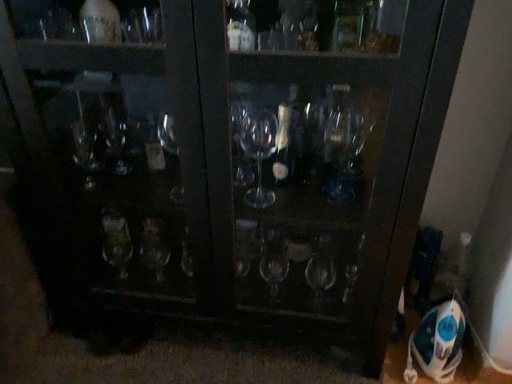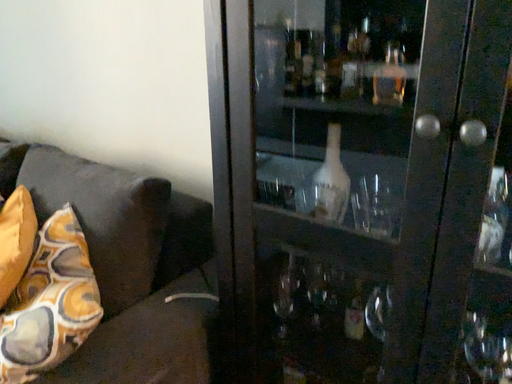
Question: Which way did the camera rotate in the video?

Choices:
 (A) rotated upward
 (B) rotated downward

Answer: (A)